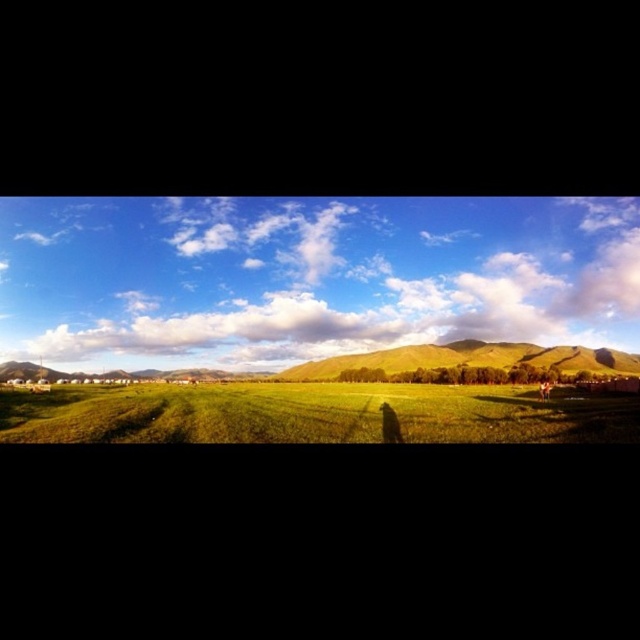
You are standing at the origin point of the coordinate system. You want to walk to the green grassy field at center. Which direction should you walk?

The green grassy field at center is located at coordinate point 0.648 on the x axis and 0.492 on the y axis. Since the origin is at the bottom left corner, you should walk northeast to reach it.

You are standing in the serene landscape and want to take a photo of the green grassy hill at center and the brown textured hair at lower right. Which object should you position to the left side of your camera frame to include both in the shot?

To include both the green grassy hill at center and the brown textured hair at lower right in your camera frame, you should position the brown textured hair at lower right on the left side of the frame since the green grassy hill at center is already on the right side of the brown textured hair at lower right.